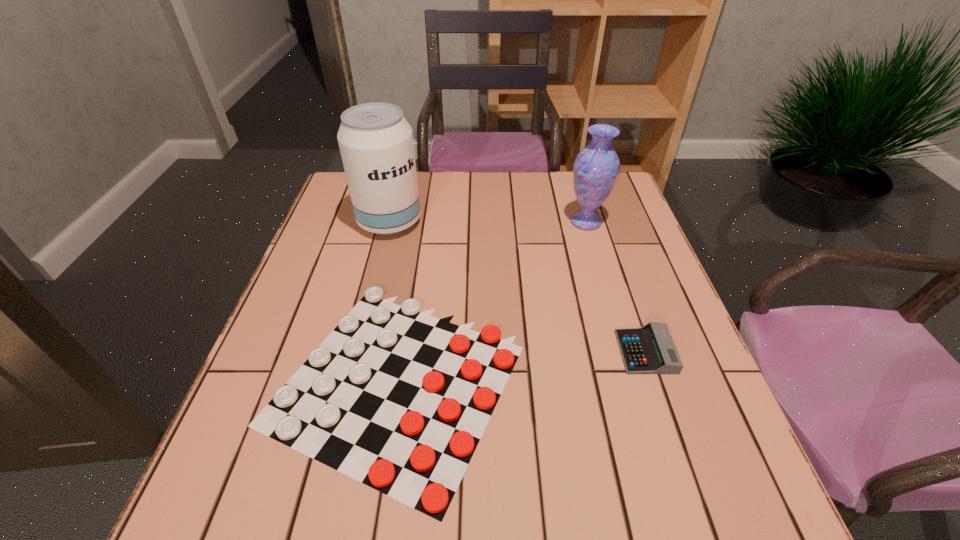
Where is `free point at the right edge`? This screenshot has height=540, width=960. free point at the right edge is located at coordinates (605, 223).

The width and height of the screenshot is (960, 540). In order to click on vacant space at the far right corner of the desktop in this screenshot , I will do (618, 207).

In the image, there is a desktop. Identify the location of vacant space at the near right corner. (686, 480).

In order to click on free area in between the alcohol and the shortest object in this screenshot , I will do `click(395, 301)`.

Where is `blank region between the alcohol and the third tallest object`? blank region between the alcohol and the third tallest object is located at coordinates (517, 287).

Where is `unoccupied area between the shortest object and the alcohol`? Image resolution: width=960 pixels, height=540 pixels. unoccupied area between the shortest object and the alcohol is located at coordinates (395, 301).

This screenshot has width=960, height=540. I want to click on unoccupied area between the vase and the third tallest object, so click(x=615, y=287).

Identify the location of free space between the calculator and the checkerboard. (522, 366).

Image resolution: width=960 pixels, height=540 pixels. I want to click on unoccupied area between the vase and the second shortest object, so click(x=615, y=287).

This screenshot has width=960, height=540. Identify the location of free spot between the third shortest object and the alcohol. tap(488, 222).